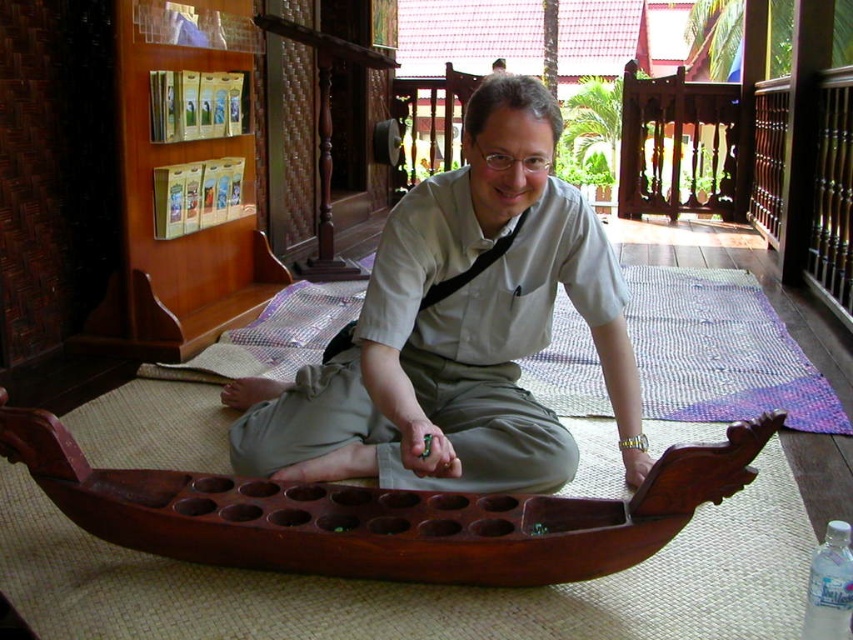
Is dark wood rowboat at center in front of clear plastic bottle at lower right?

No, dark wood rowboat at center is further to the viewer.

Who is positioned more to the left, dark wood rowboat at center or clear plastic bottle at lower right?

dark wood rowboat at center is more to the left.

Which is behind, point (398, 515) or point (817, 593)?

The point (398, 515) is behind.

Where is `dark wood rowboat at center`? dark wood rowboat at center is located at coordinates (379, 513).

Is matte beige shirt at center to the right of clear plastic bottle at lower right from the viewer's perspective?

No, matte beige shirt at center is not to the right of clear plastic bottle at lower right.

Is matte beige shirt at center wider than clear plastic bottle at lower right?

Indeed, matte beige shirt at center has a greater width compared to clear plastic bottle at lower right.

Does point (519, 289) lie behind point (819, 566)?

Yes, it is.

Where is `matte beige shirt at center`? The width and height of the screenshot is (853, 640). matte beige shirt at center is located at coordinates (459, 330).

Can you confirm if matte beige shirt at center is bigger than dark wood rowboat at center?

Yes.

Based on the photo, which of these two, matte beige shirt at center or dark wood rowboat at center, stands shorter?

Standing shorter between the two is dark wood rowboat at center.

Between point (427, 417) and point (247, 492), which one is positioned in front?

Positioned in front is point (247, 492).

Locate an element on the screen. This screenshot has height=640, width=853. matte beige shirt at center is located at coordinates (459, 330).